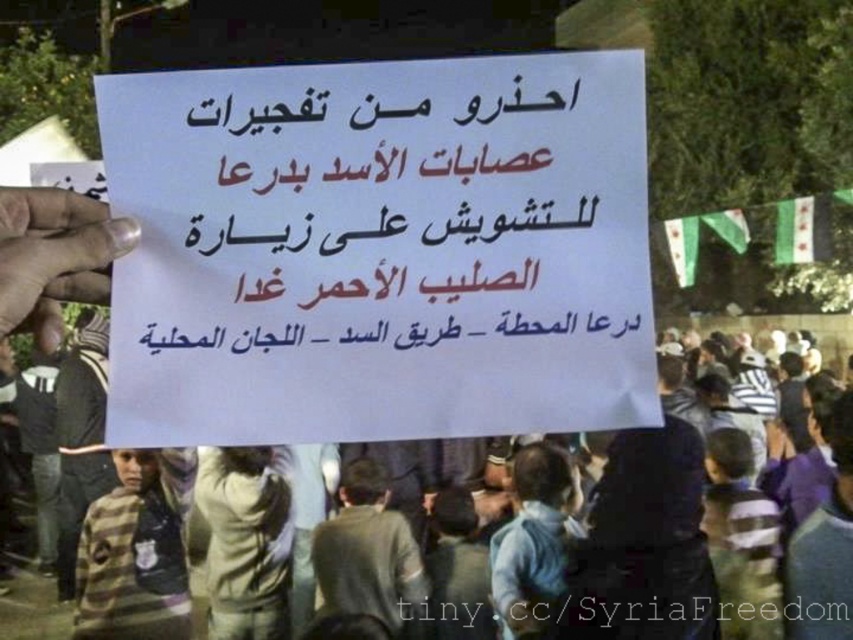
You are a photographer trying to capture the white paper sign at center and the dark gray jacket at left in the same frame. Given that your camera has a minimum focus distance of 10 feet, will you be able to capture both objects clearly in the photo?

The distance between the white paper sign at center and the dark gray jacket at left is 9.52 feet, which is less than the camera minimum focus distance of 10 feet. Therefore, you cannot capture both objects clearly in the same frame.

You are a photographer standing at the camera position. You want to take a closeup of the gray woolen sweater at center without moving your position. Is it possible to zoom in enough to capture the sweater clearly?

The gray woolen sweater at center is 2.39 meters from the camera. With a standard zoom lens, it should be possible to zoom in sufficiently to capture the sweater clearly at that distance.

You are a photographer trying to capture both the gray woolen sweater at center and the dark gray jacket at left in a single frame. Based on their positions, which clothing item would appear taller in the photo?

The dark gray jacket at left appears taller than the gray woolen sweater at center because the gray woolen sweater at center is not as tall as the dark gray jacket at left.